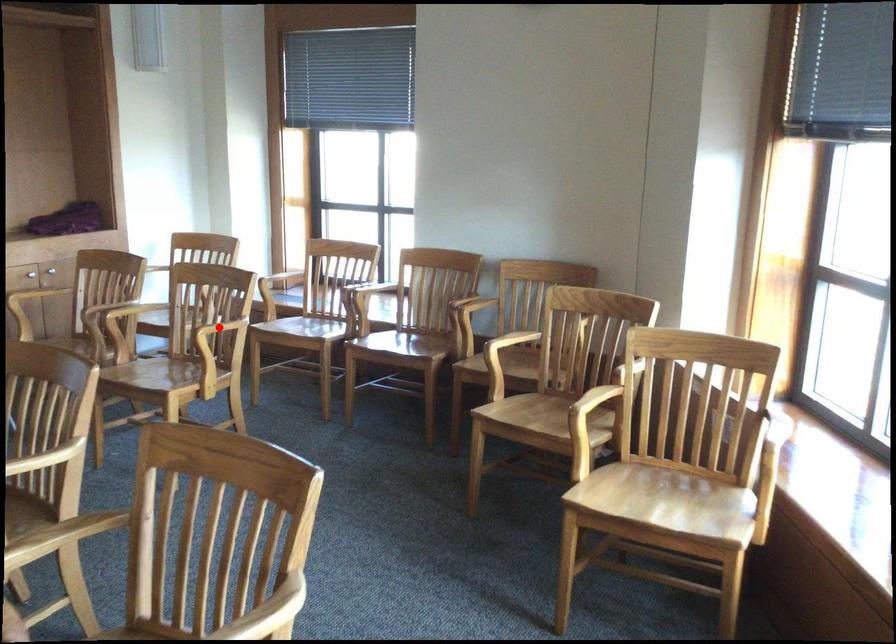
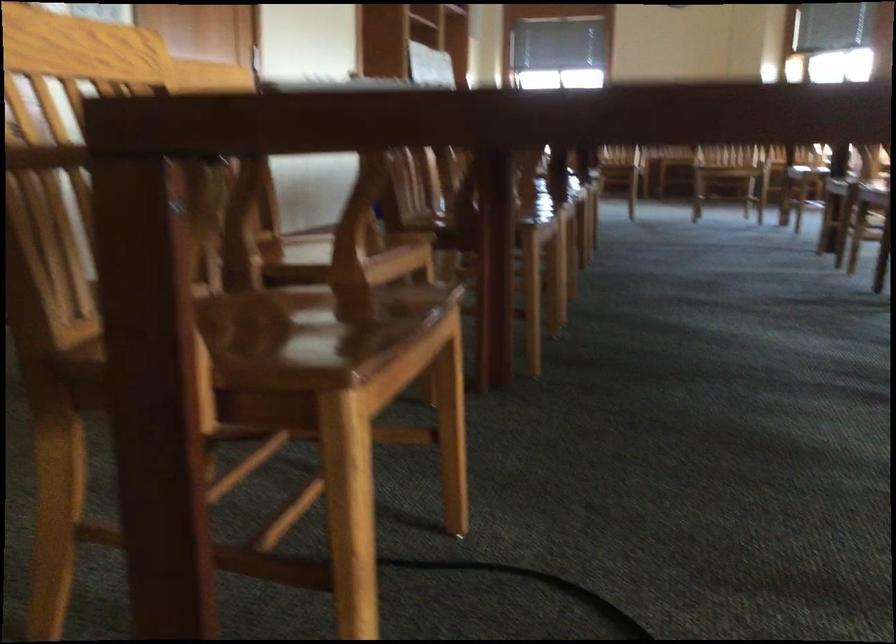
Question: I am providing you with two images of the same scene from different viewpoints. A red point is marked on the first image. Can you still see the location of the red point in image 2?

Choices:
 (A) Yes
 (B) No

Answer: (B)